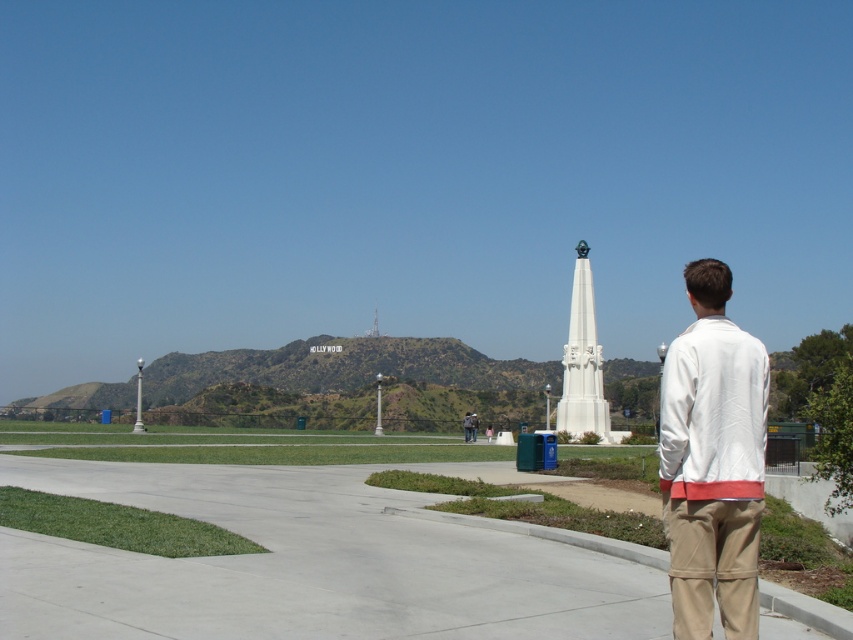
Can you confirm if gray concrete pavement at center is smaller than khaki cotton pants at lower right?

Incorrect, gray concrete pavement at center is not smaller in size than khaki cotton pants at lower right.

Is gray concrete pavement at center further to camera compared to khaki cotton pants at lower right?

Yes.

Locate an element on the screen. gray concrete pavement at center is located at coordinates (316, 563).

Based on the photo, is white cotton jacket at lower right smaller than khaki cotton pants at lower right?

Incorrect, white cotton jacket at lower right is not smaller in size than khaki cotton pants at lower right.

Does white cotton jacket at lower right appear over khaki cotton pants at lower right?

Yes.

At what (x,y) coordinates should I click in order to perform the action: click on white cotton jacket at lower right. Please return your answer as a coordinate pair (x, y). Image resolution: width=853 pixels, height=640 pixels. Looking at the image, I should click on (712, 461).

Does gray concrete pavement at center appear over white cotton jacket at lower right?

No.

What do you see at coordinates (316, 563) in the screenshot? The image size is (853, 640). I see `gray concrete pavement at center` at bounding box center [316, 563].

Image resolution: width=853 pixels, height=640 pixels. I want to click on gray concrete pavement at center, so click(x=316, y=563).